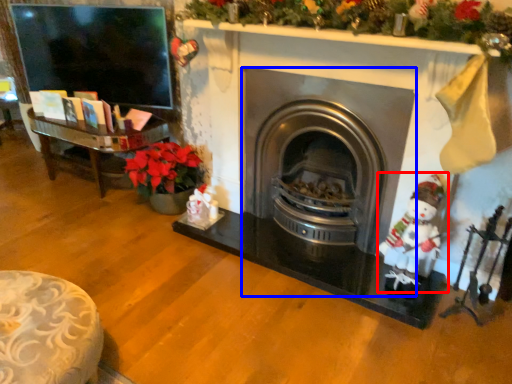
Question: Which point is further to the camera, santa claus (highlighted by a red box) or wood burning stove (highlighted by a blue box)?

Choices:
 (A) santa claus
 (B) wood burning stove

Answer: (B)